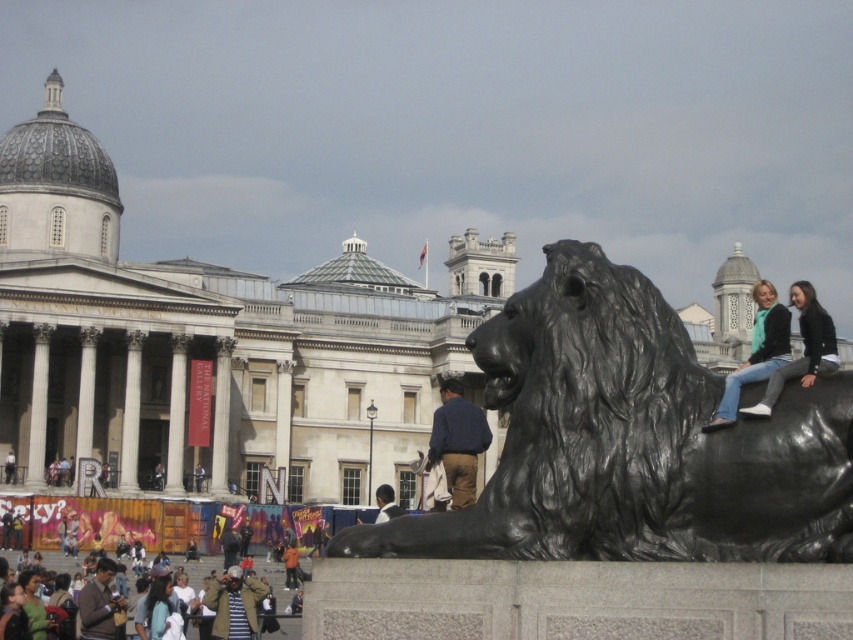
You are a photographer planning to take a photo of the black polished stone lion at center and the light brown hair at center. Based on their heights, which object should you focus on first to ensure proper framing?

The black polished stone lion at center is much taller than the light brown hair at center, so you should focus on the black polished stone lion at center first to ensure proper framing.

What object is located at the coordinates point (631, 442) in the image?

The point (631, 442) marks the black polished stone lion at center.